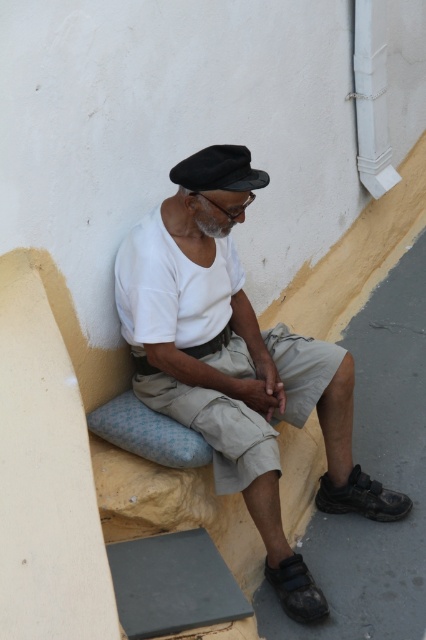
Looking at this image, based on the scene description, where is the white cotton shirt at center located in terms of coordinates?

The white cotton shirt at center is located at the coordinates point (238, 376).